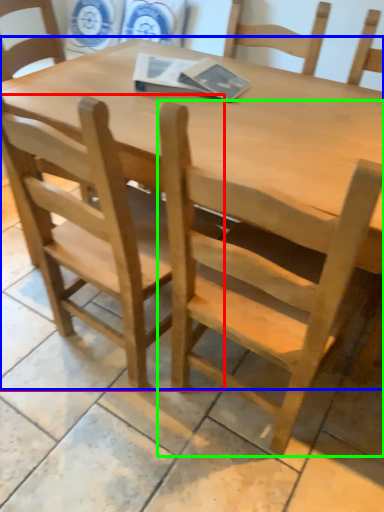
Question: Which object is positioned farthest from chair (highlighted by a red box)? Select from table (highlighted by a blue box) and chair (highlighted by a green box).

Choices:
 (A) table
 (B) chair

Answer: (A)